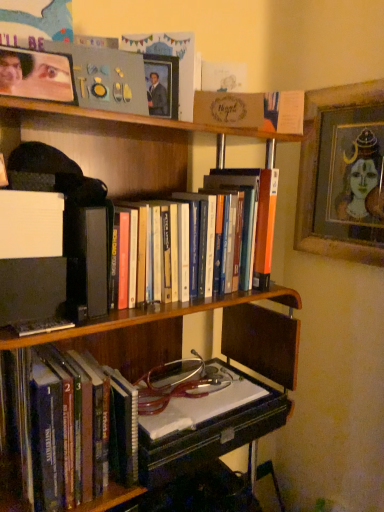
Question: Could you tell me if hardcover books at center, marked as the 1th book in a top-to-bottom arrangement, is turned towards wooden picture frame at upper center, acting as the 2th picture frame starting from the front?

Choices:
 (A) no
 (B) yes

Answer: (A)

Question: From the image's perspective, is hardcover books at center, marked as the 1th book in a top-to-bottom arrangement, beneath wooden picture frame at upper center, the second picture frame positioned from the right?

Choices:
 (A) no
 (B) yes

Answer: (B)

Question: Considering the relative positions of hardcover books at center, arranged as the second book when ordered from the bottom, and wooden picture frame at upper center, which is the 2th picture frame from left to right, in the image provided, is hardcover books at center, arranged as the second book when ordered from the bottom, to the left of wooden picture frame at upper center, which is the 2th picture frame from left to right, from the viewer's perspective?

Choices:
 (A) no
 (B) yes

Answer: (A)

Question: Are hardcover books at center, marked as the 1th book in a top-to-bottom arrangement, and wooden picture frame at upper center, acting as the 2th picture frame starting from the front, far apart?

Choices:
 (A) yes
 (B) no

Answer: (B)

Question: From the image's perspective, is hardcover books at center, marked as the 1th book in a top-to-bottom arrangement, on top of wooden picture frame at upper center, the second picture frame positioned from the right?

Choices:
 (A) no
 (B) yes

Answer: (A)

Question: Is wooden framed portrait at upper right, placed as the 3th picture frame when sorted from left to right, bigger or smaller than hardcover books at left, the first book from the bottom?

Choices:
 (A) small
 (B) big

Answer: (A)

Question: Would you say wooden framed portrait at upper right, which appears as the 3th picture frame when viewed from the front, is to the left or to the right of hardcover books at left, the first book from the bottom, in the picture?

Choices:
 (A) right
 (B) left

Answer: (A)

Question: In terms of width, does wooden framed portrait at upper right, the first picture frame positioned from the right, look wider or thinner when compared to hardcover books at left, which is the 2th book in top-to-bottom order?

Choices:
 (A) wide
 (B) thin

Answer: (B)

Question: In the image, is wooden framed portrait at upper right, the first picture frame viewed from the back, positioned in front of or behind hardcover books at left, which is the 2th book in top-to-bottom order?

Choices:
 (A) behind
 (B) front

Answer: (A)

Question: Considering the positions of hardcover books at center, arranged as the second book when ordered from the bottom, and wooden framed portrait at upper right, the first picture frame viewed from the back, in the image, is hardcover books at center, arranged as the second book when ordered from the bottom, wider or thinner than wooden framed portrait at upper right, the first picture frame viewed from the back,?

Choices:
 (A) wide
 (B) thin

Answer: (A)

Question: Considering the positions of hardcover books at center, marked as the 1th book in a top-to-bottom arrangement, and wooden framed portrait at upper right, the first picture frame positioned from the right, in the image, is hardcover books at center, marked as the 1th book in a top-to-bottom arrangement, taller or shorter than wooden framed portrait at upper right, the first picture frame positioned from the right,?

Choices:
 (A) short
 (B) tall

Answer: (A)

Question: Is hardcover books at center, arranged as the second book when ordered from the bottom, inside the boundaries of wooden framed portrait at upper right, placed as the 3th picture frame when sorted from left to right, or outside?

Choices:
 (A) inside
 (B) outside

Answer: (B)

Question: Considering the positions of hardcover books at center, arranged as the second book when ordered from the bottom, and wooden framed portrait at upper right, the first picture frame positioned from the right, in the image, is hardcover books at center, arranged as the second book when ordered from the bottom, bigger or smaller than wooden framed portrait at upper right, the first picture frame positioned from the right,?

Choices:
 (A) big
 (B) small

Answer: (A)

Question: Does point (57, 394) appear closer or farther from the camera than point (241, 274)?

Choices:
 (A) farther
 (B) closer

Answer: (B)

Question: From a real-world perspective, is hardcover books at left, the first book from the bottom, positioned above or below hardcover books at center, marked as the 1th book in a top-to-bottom arrangement?

Choices:
 (A) below
 (B) above

Answer: (A)